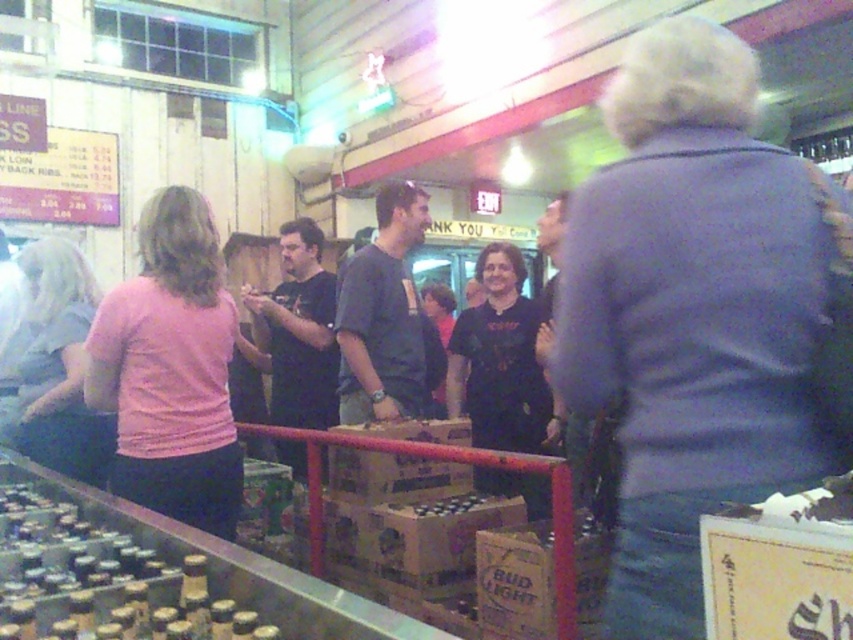
You are a photographer trying to capture both the purple sweater at center and the black matte shirt at center in a single frame. Since the scene is blurry, you decide to adjust your camera focus. Which item should you focus on first if you want to ensure the smaller object is in sharp detail?

The purple sweater at center has a smaller size compared to the black matte shirt at center, so you should focus on the purple sweater at center first to ensure its details are sharp.

You are standing at the counter in the bar scene. There are two points marked on the counter. The first point is at coordinates point (154, 300) and the second is at point (70, 388). Which point is closer to you?

Point (154, 300) is closer to the viewer than point (70, 388).